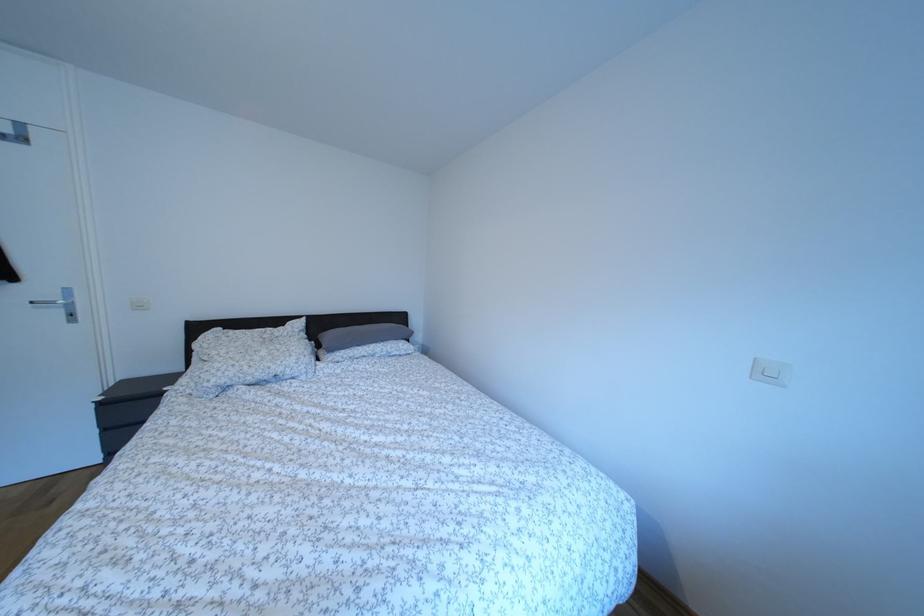
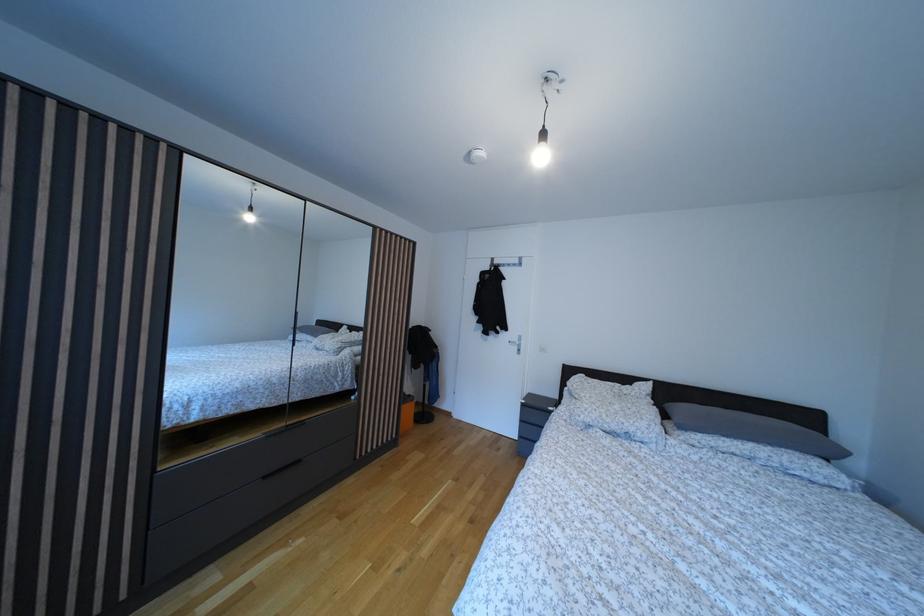
Question: The first image is from the beginning of the video and the second image is from the end. How did the camera likely rotate when shooting the video?

Choices:
 (A) Left
 (B) Right
 (C) Up
 (D) Down

Answer: (A)